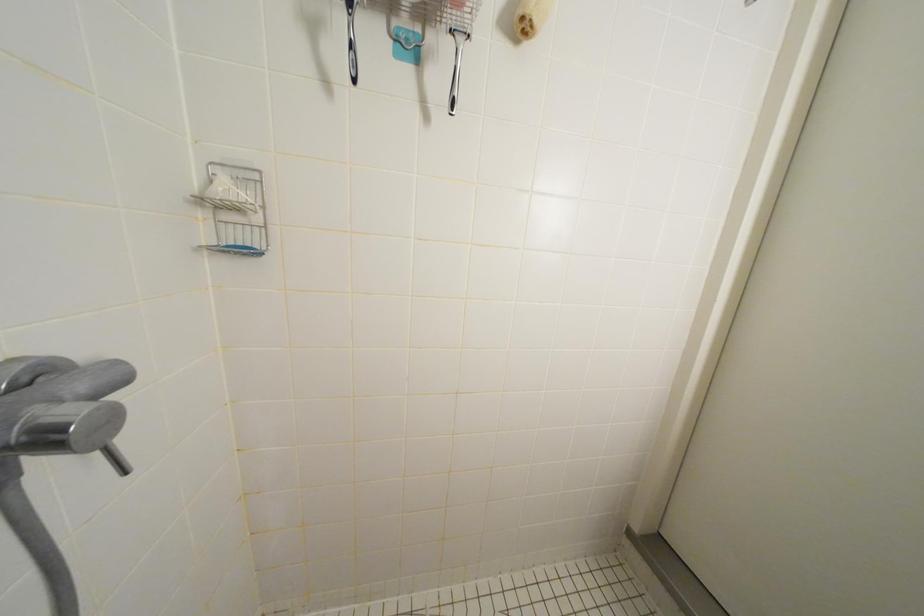
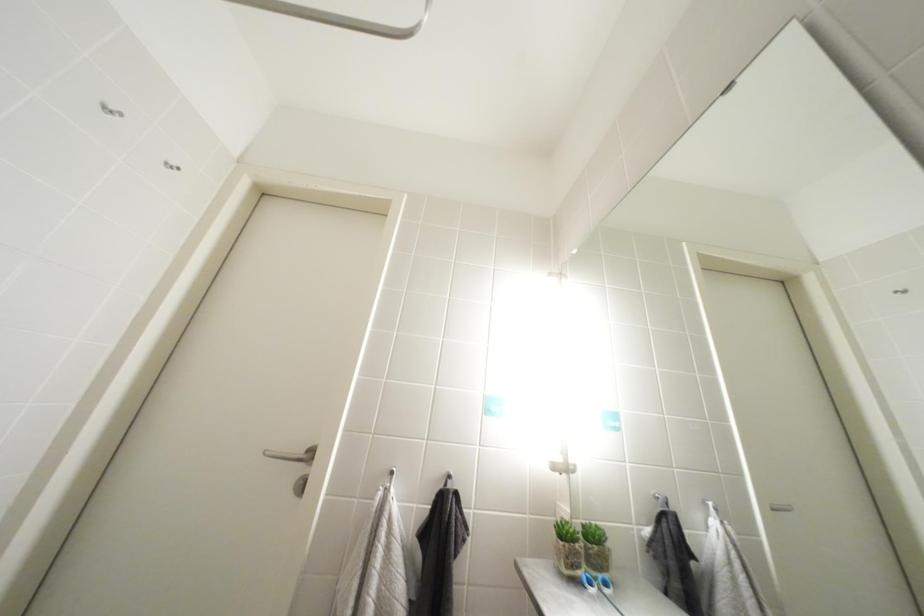
Based on the continuous images, in which direction is the camera rotating?

The camera's rotation is toward right-up.